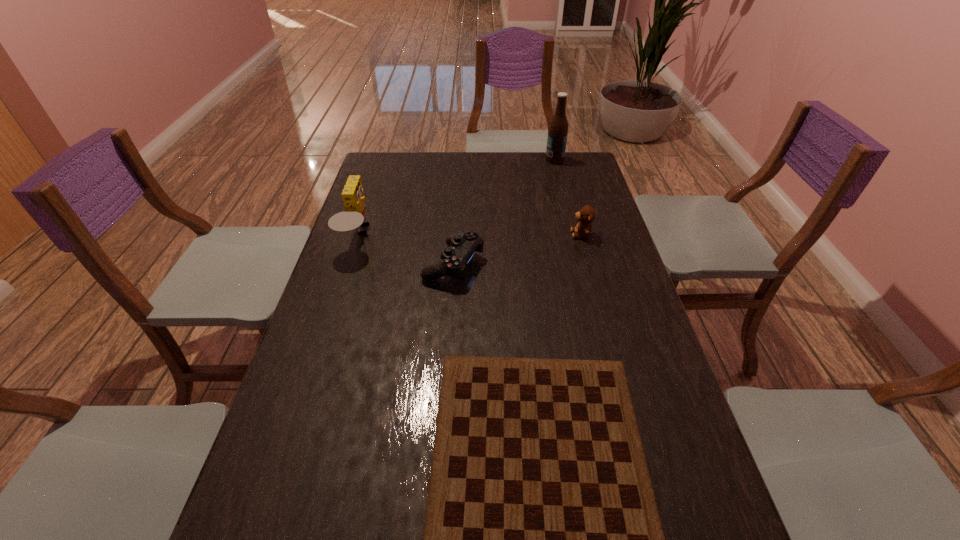
In the image, there is a desktop. What are the coordinates of `blank space at the far left corner` in the screenshot? It's located at (398, 179).

Identify the location of empty space between the third tallest object and the beer bottle. This screenshot has width=960, height=540. (567, 197).

Image resolution: width=960 pixels, height=540 pixels. I want to click on free space between the sponge and the control, so click(406, 250).

I want to click on free spot between the tallest object and the third tallest object, so click(x=567, y=197).

Identify the location of empty space that is in between the sponge and the tallest object. The image size is (960, 540). (457, 198).

Image resolution: width=960 pixels, height=540 pixels. Find the location of `vacant area that lies between the third tallest object and the control`. vacant area that lies between the third tallest object and the control is located at coordinates (517, 249).

This screenshot has height=540, width=960. What are the coordinates of `vacant point located between the fourth tallest object and the sponge` in the screenshot? It's located at (406, 250).

I want to click on free space between the second shortest object and the teddy bear, so click(517, 249).

Image resolution: width=960 pixels, height=540 pixels. I want to click on free area in between the leftmost object and the tallest object, so click(457, 198).

Locate an element on the screen. The image size is (960, 540). free space between the tallest object and the leftmost object is located at coordinates (457, 198).